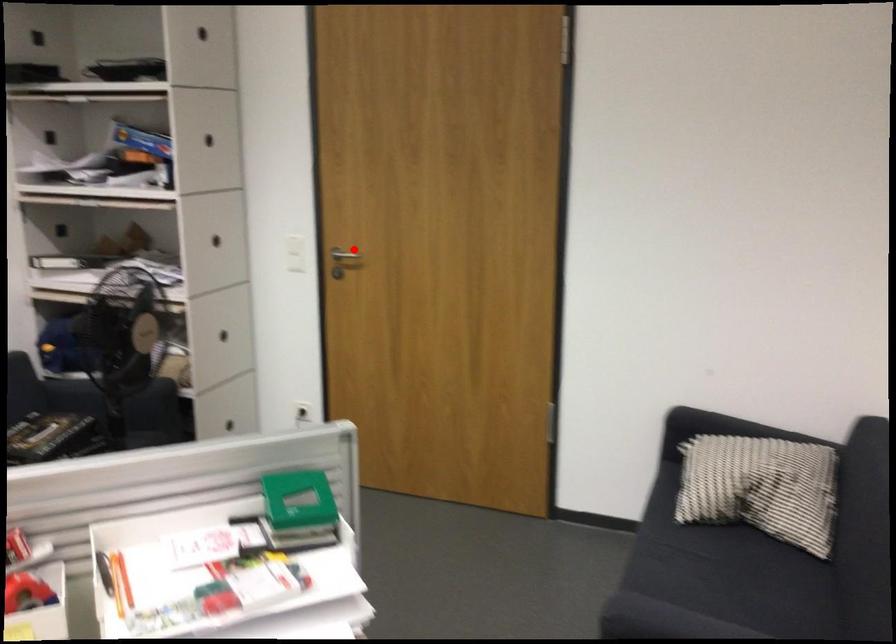
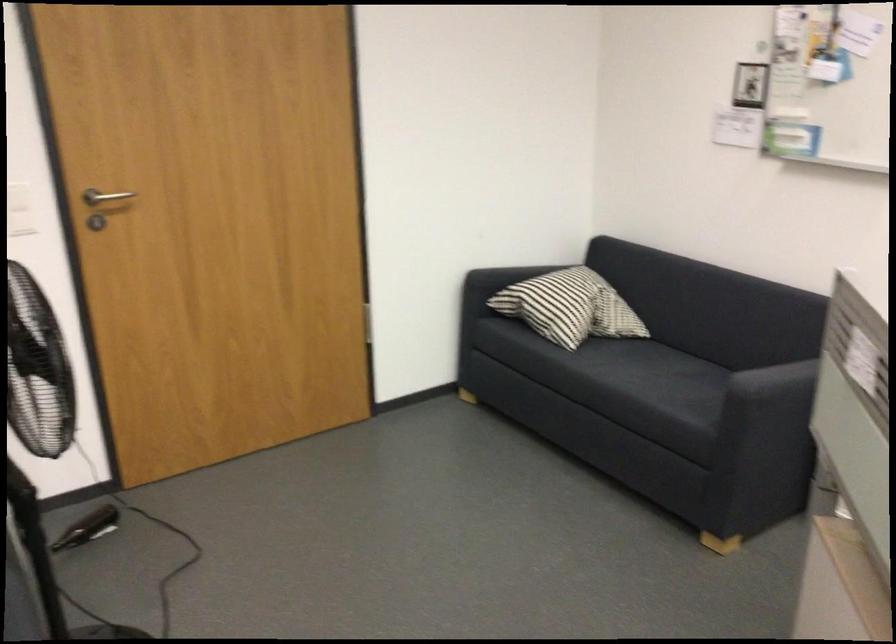
The point at the highlighted location is marked in the first image. Where is the corresponding point in the second image?

(105, 196)